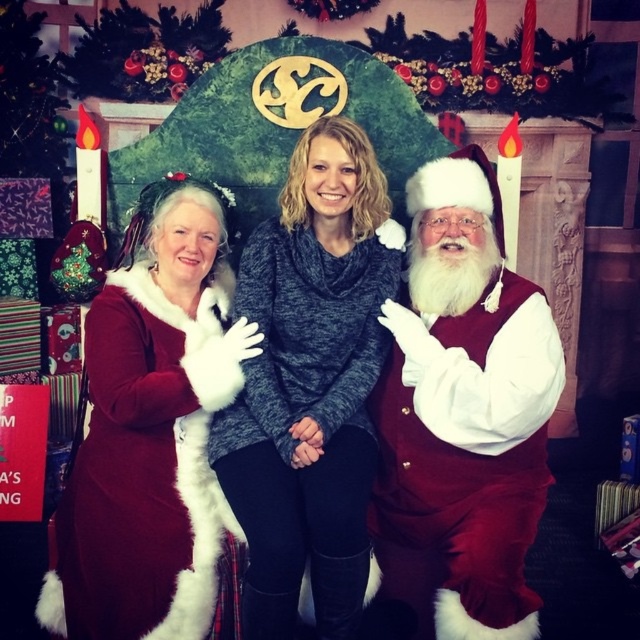
Between point (524, 410) and point (138, 636), which one is positioned in front?

Point (138, 636)

Which is more to the left, fuzzy red dress at center or velvet red coat at center?

Positioned to the left is velvet red coat at center.

What do you see at coordinates (460, 417) in the screenshot? This screenshot has width=640, height=640. I see `fuzzy red dress at center` at bounding box center [460, 417].

Find the location of `fuzzy red dress at center`. fuzzy red dress at center is located at coordinates (460, 417).

Is fuzzy red dress at center positioned before white fluffy santa at right?

That is True.

Find the location of a particular element. The height and width of the screenshot is (640, 640). fuzzy red dress at center is located at coordinates (460, 417).

From the picture: Who is more forward, (426, 572) or (538, 460)?

Point (426, 572) is more forward.

At what (x,y) coordinates should I click in order to perform the action: click on fuzzy red dress at center. Please return your answer as a coordinate pair (x, y). The height and width of the screenshot is (640, 640). Looking at the image, I should click on (460, 417).

Does gray sweater at center appear over velvet red coat at center?

Correct, gray sweater at center is located above velvet red coat at center.

Can you confirm if gray sweater at center is thinner than velvet red coat at center?

Yes, gray sweater at center is thinner than velvet red coat at center.

Image resolution: width=640 pixels, height=640 pixels. I want to click on gray sweater at center, so click(x=310, y=385).